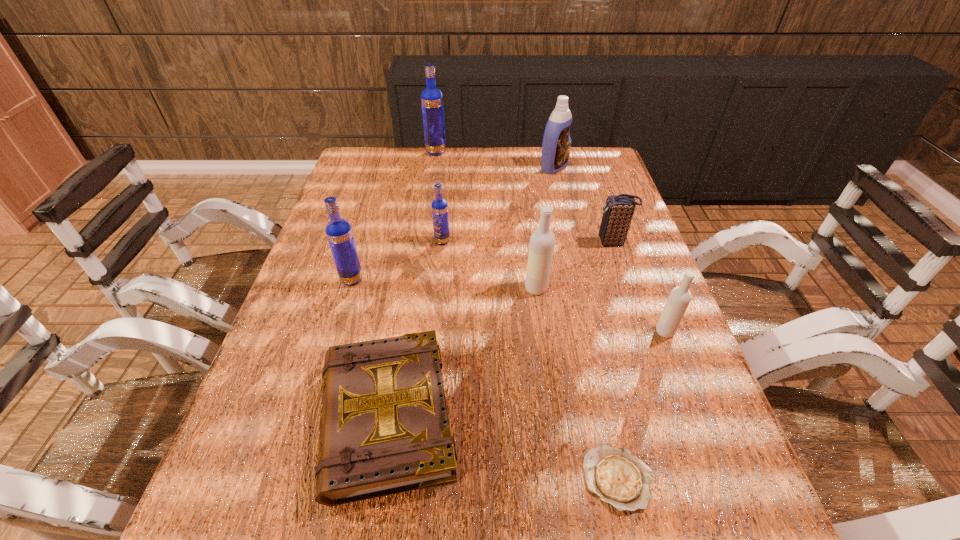
In the image, there is a desktop. Identify the location of free space at the far left corner. (365, 164).

The image size is (960, 540). In the image, there is a desktop. What are the coordinates of `vacant space at the near left corner` in the screenshot? It's located at (213, 531).

You are a GUI agent. You are given a task and a screenshot of the screen. Output one action in this format:
    pyautogui.click(x=<x>, y=<y>)
    Task: Click on the free space between the hardback book and the second farthest object
    The height and width of the screenshot is (540, 960).
    Given the screenshot: What is the action you would take?
    470,292

Find the location of a particular element. This screenshot has height=540, width=960. vacant space that is in between the fourth vodka from left to right and the brown hardback book is located at coordinates (462, 353).

Where is `vacant area that lies between the brown hardback book and the clutch bag`? vacant area that lies between the brown hardback book and the clutch bag is located at coordinates tap(500, 330).

At what (x,y) coordinates should I click in order to perform the action: click on unoccupied position between the quiche and the clutch bag. Please return your answer as a coordinate pair (x, y). The height and width of the screenshot is (540, 960). Looking at the image, I should click on (615, 360).

You are a GUI agent. You are given a task and a screenshot of the screen. Output one action in this format:
    pyautogui.click(x=<x>, y=<y>)
    Task: Click on the free space between the rightmost vodka and the seventh tallest object
    This screenshot has width=960, height=540.
    Given the screenshot: What is the action you would take?
    pyautogui.click(x=639, y=287)

Identify the location of free space that is in between the eighth tallest object and the eighth nearest object. (470, 292).

This screenshot has height=540, width=960. What are the coordinates of `vacant point located between the leftmost vodka and the shortest object` in the screenshot? It's located at (485, 379).

Select which object is the second closest to the nearer white vodka. Please provide its 2D coordinates. Your answer should be formatted as a tuple, i.e. [(x, y)], where the tuple contains the x and y coordinates of a point satisfying the conditions above.

[(618, 477)]